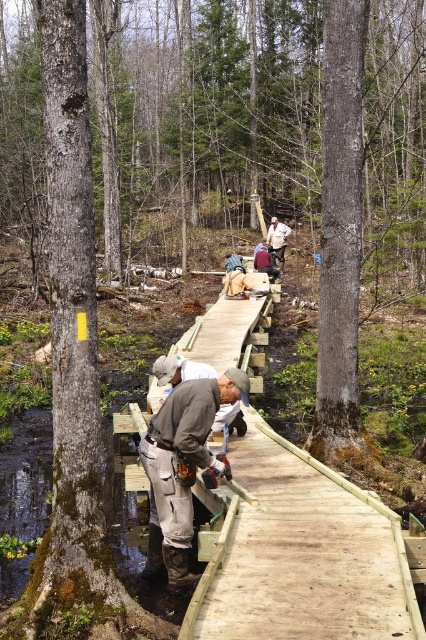
Based on the scene description and the coordinates provided, what object or feature is located at the point with coordinates [340,240]?

The point at coordinates [340,240] indicates smooth gray bark at center.

You are a worker standing at the point marked as point (345, 380). You need to move to the point marked as point (160, 536). Which direction should you move relative to the boardwalk?

Point (345, 380) is behind point (160, 536), so you should move forward towards the point (160, 536) along the boardwalk.